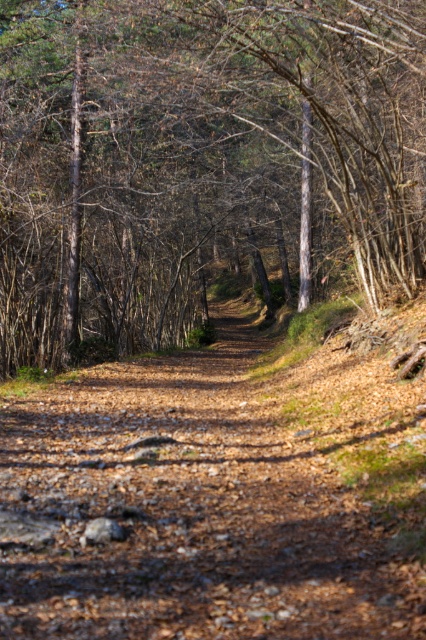
Looking at this image, between brown bark tree at center and brown dirt track at center, which one has more height?

Standing taller between the two is brown bark tree at center.

Can you confirm if brown bark tree at center is shorter than brown dirt track at center?

No, brown bark tree at center is not shorter than brown dirt track at center.

What do you see at coordinates (201, 161) in the screenshot?
I see `brown bark tree at center` at bounding box center [201, 161].

Locate an element on the screen. The width and height of the screenshot is (426, 640). brown bark tree at center is located at coordinates (201, 161).